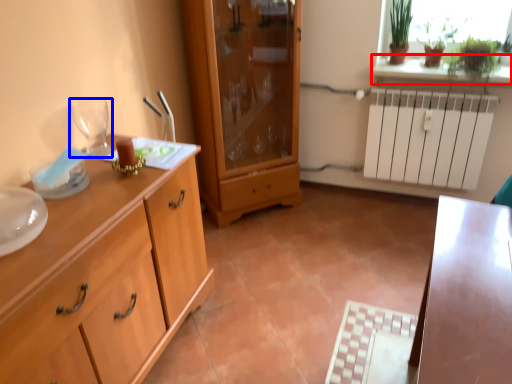
Question: Which object appears closest to the camera in this image, window sill (highlighted by a red box) or wine glass (highlighted by a blue box)?

Choices:
 (A) window sill
 (B) wine glass

Answer: (B)